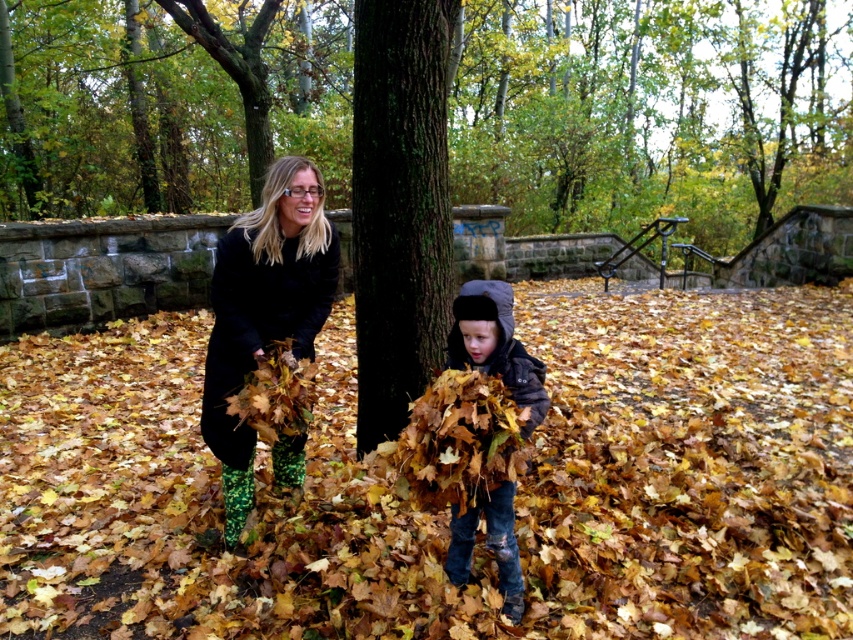
Question: Estimate the real-world distances between objects in this image. Which object is closer to the dark green textured bark at center?

Choices:
 (A) brown fuzzy coat at center
 (B) matte black coat at center

Answer: (B)

Question: Which object appears closest to the camera in this image?

Choices:
 (A) matte black coat at center
 (B) green rough bark tree at center
 (C) dark green textured bark at center

Answer: (A)

Question: Is green rough bark tree at center further to camera compared to matte black coat at center?

Choices:
 (A) no
 (B) yes

Answer: (B)

Question: Is green rough bark tree at center in front of dark green textured bark at center?

Choices:
 (A) yes
 (B) no

Answer: (B)

Question: Which point is farther to the camera?

Choices:
 (A) dark green textured bark at center
 (B) brown fuzzy coat at center
 (C) green rough bark tree at center

Answer: (C)

Question: Is dark green textured bark at center smaller than brown fuzzy coat at center?

Choices:
 (A) no
 (B) yes

Answer: (A)